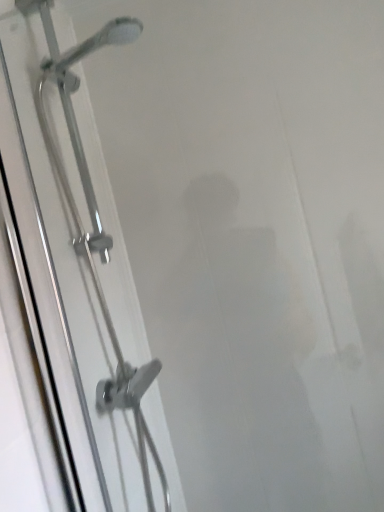
Locate an element on the screen. transparent glass screen door at left is located at coordinates (79, 270).

What do you see at coordinates (79, 270) in the screenshot? The height and width of the screenshot is (512, 384). I see `transparent glass screen door at left` at bounding box center [79, 270].

Locate an element on the screen. The image size is (384, 512). transparent glass screen door at left is located at coordinates [79, 270].